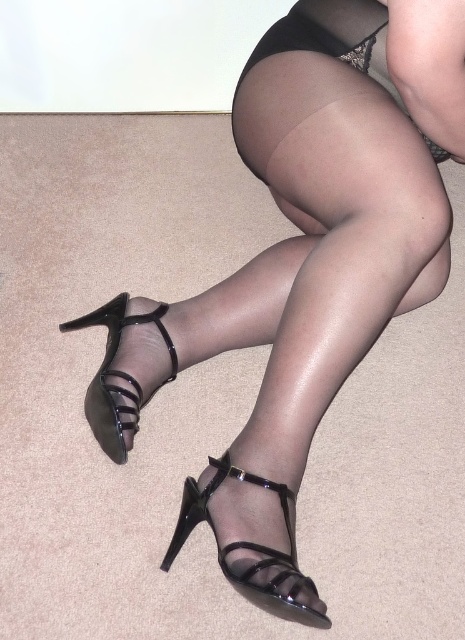
Question: Which of these objects is positioned closest to the black patent leather sandal at lower center?

Choices:
 (A) black patent leather high-heeled sandal at lower left
 (B) black sheer dress at upper center

Answer: (A)

Question: Which object is the closest to the black patent leather high-heeled sandal at lower left?

Choices:
 (A) black sheer dress at upper center
 (B) black patent leather sandal at lower center

Answer: (B)

Question: Is black patent leather sandal at lower center positioned behind black patent leather high-heeled sandal at lower left?

Choices:
 (A) no
 (B) yes

Answer: (A)

Question: Is black patent leather sandal at lower center wider than black sheer dress at upper center?

Choices:
 (A) yes
 (B) no

Answer: (B)

Question: Which object appears closest to the camera in this image?

Choices:
 (A) black patent leather sandal at lower center
 (B) black sheer dress at upper center
 (C) black patent leather high-heeled sandal at lower left

Answer: (A)

Question: Can you confirm if black patent leather high-heeled sandal at lower left is positioned below black sheer dress at upper center?

Choices:
 (A) yes
 (B) no

Answer: (A)